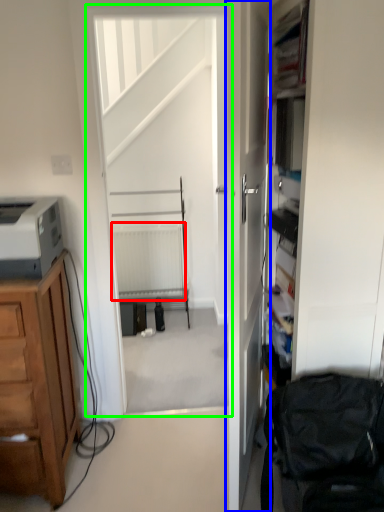
Question: Considering the real-world distances, which object is closest to radiator (highlighted by a red box)? door (highlighted by a blue box) or screen door (highlighted by a green box).

Choices:
 (A) door
 (B) screen door

Answer: (B)